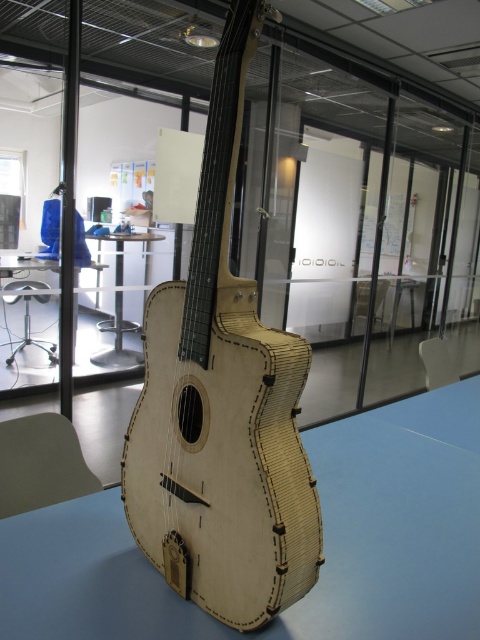
Between light wood table at center and wooden table at center, which one appears on the left side from the viewer's perspective?

Positioned to the left is wooden table at center.

Does point (435, 616) lie in front of point (130, 365)?

Yes, point (435, 616) is in front of point (130, 365).

This screenshot has height=640, width=480. Identify the location of light wood table at center. (324, 541).

Which is more to the right, natural wood guitar at center or light wood table at center?

light wood table at center is more to the right.

Measure the distance between point [242,440] and camera.

A: 35.40 inches

Which is in front, point (264, 451) or point (386, 522)?

Point (264, 451) is in front.

Find the location of a particular element. natural wood guitar at center is located at coordinates (222, 404).

Can you confirm if natural wood guitar at center is bigger than wooden table at center?

No.

Which of these two, natural wood guitar at center or wooden table at center, stands taller?

natural wood guitar at center

Where is `natural wood guitar at center`? natural wood guitar at center is located at coordinates (222, 404).

What are the coordinates of `natural wood guitar at center` in the screenshot? It's located at (222, 404).